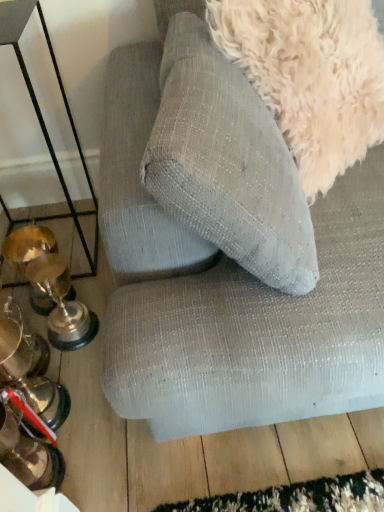
Question: Is metallic trophies at left positioned in front of textured fabric couch at upper center?

Choices:
 (A) yes
 (B) no

Answer: (B)

Question: Would you consider metallic trophies at left to be distant from textured fabric couch at upper center?

Choices:
 (A) yes
 (B) no

Answer: (B)

Question: Is metallic trophies at left at the right side of textured fabric couch at upper center?

Choices:
 (A) no
 (B) yes

Answer: (A)

Question: Could you tell me if metallic trophies at left is turned towards textured fabric couch at upper center?

Choices:
 (A) yes
 (B) no

Answer: (A)

Question: Is metallic trophies at left at the left side of textured fabric couch at upper center?

Choices:
 (A) yes
 (B) no

Answer: (A)

Question: Is fuzzy white dog at upper right spatially inside metallic trophies at left, or outside of it?

Choices:
 (A) outside
 (B) inside

Answer: (A)

Question: Considering the positions of fuzzy white dog at upper right and metallic trophies at left in the image, is fuzzy white dog at upper right taller or shorter than metallic trophies at left?

Choices:
 (A) tall
 (B) short

Answer: (B)

Question: From the image's perspective, is fuzzy white dog at upper right above or below metallic trophies at left?

Choices:
 (A) above
 (B) below

Answer: (A)

Question: From a real-world perspective, is fuzzy white dog at upper right above or below metallic trophies at left?

Choices:
 (A) above
 (B) below

Answer: (A)

Question: In terms of width, does fuzzy white dog at upper right look wider or thinner when compared to textured fabric couch at upper center?

Choices:
 (A) thin
 (B) wide

Answer: (A)

Question: Looking at the image, does fuzzy white dog at upper right seem bigger or smaller compared to textured fabric couch at upper center?

Choices:
 (A) big
 (B) small

Answer: (B)

Question: From their relative heights in the image, would you say fuzzy white dog at upper right is taller or shorter than textured fabric couch at upper center?

Choices:
 (A) tall
 (B) short

Answer: (B)

Question: From the image's perspective, relative to textured fabric couch at upper center, is fuzzy white dog at upper right above or below?

Choices:
 (A) above
 (B) below

Answer: (A)

Question: From a real-world perspective, is textured fabric couch at upper center physically located above or below fuzzy white dog at upper right?

Choices:
 (A) above
 (B) below

Answer: (B)

Question: Considering their positions, is textured fabric couch at upper center located in front of or behind fuzzy white dog at upper right?

Choices:
 (A) front
 (B) behind

Answer: (A)